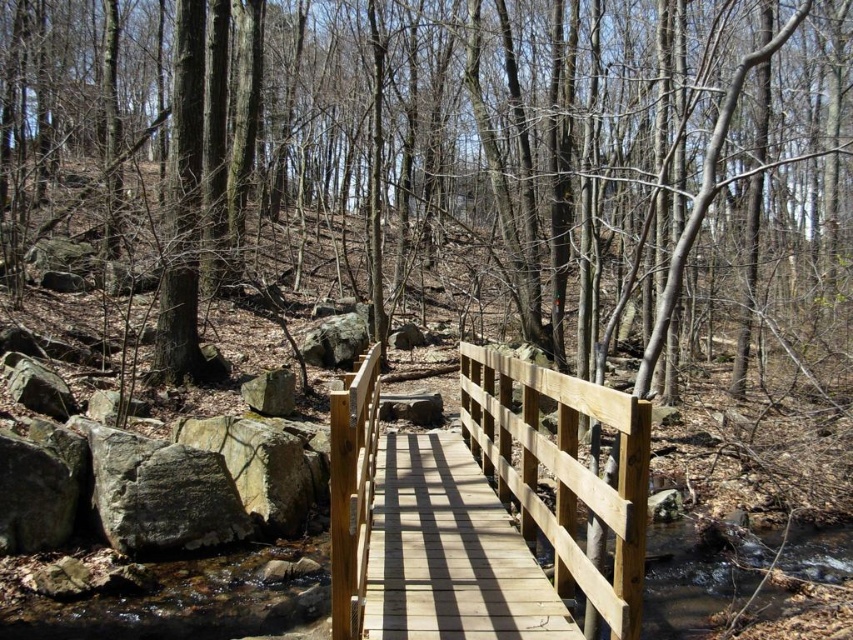
Between point (373, 476) and point (292, 374), which one is positioned in front?

Point (373, 476) is in front.

Is natural wood bridge at center to the right of gray rough stone at center-left from the viewer's perspective?

Indeed, natural wood bridge at center is positioned on the right side of gray rough stone at center-left.

I want to click on natural wood bridge at center, so click(563, 472).

Does point (42, 154) lie behind point (598, 392)?

Yes, point (42, 154) is farther from viewer.

Can you confirm if smooth brown wooden bridge at center is smaller than natural wood bridge at center?

Incorrect, smooth brown wooden bridge at center is not smaller in size than natural wood bridge at center.

This screenshot has height=640, width=853. Describe the element at coordinates (440, 160) in the screenshot. I see `smooth brown wooden bridge at center` at that location.

The width and height of the screenshot is (853, 640). I want to click on smooth brown wooden bridge at center, so click(x=440, y=160).

Who is more distant from viewer, (459, 584) or (283, 410)?

The point (283, 410) is more distant.

Image resolution: width=853 pixels, height=640 pixels. In order to click on wooden bridge at center in this screenshot , I will do `click(450, 552)`.

This screenshot has width=853, height=640. I want to click on wooden bridge at center, so click(450, 552).